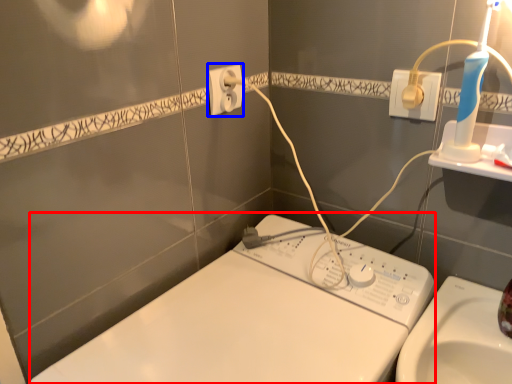
Question: Among these objects, which one is nearest to the camera, machine (highlighted by a red box) or power plugs and sockets (highlighted by a blue box)?

Choices:
 (A) machine
 (B) power plugs and sockets

Answer: (A)